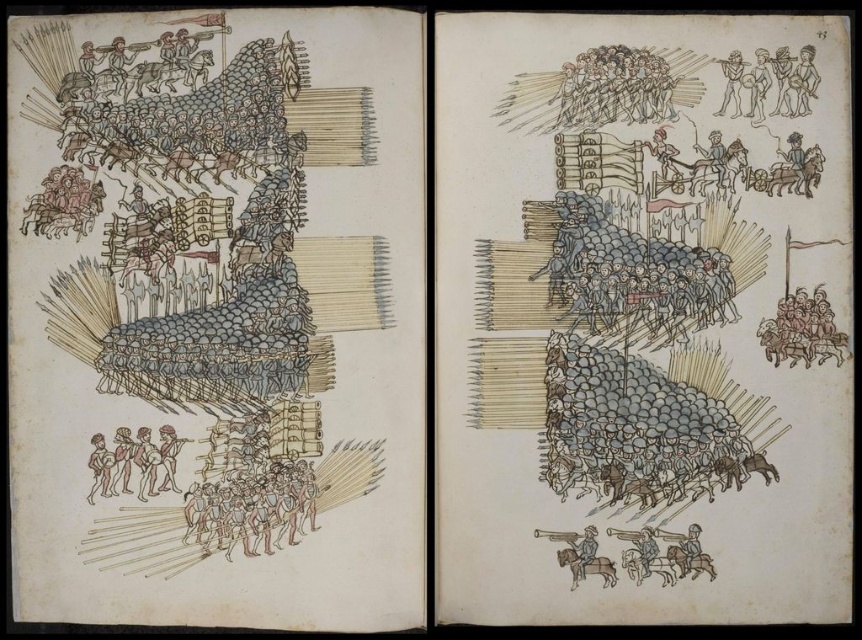
Question: Is blue-gray fabric soldiers at upper center above brown leather boots at lower left?

Choices:
 (A) yes
 (B) no

Answer: (A)

Question: Can you confirm if brown leather armor at lower right is positioned below golden armor at lower right?

Choices:
 (A) yes
 (B) no

Answer: (A)

Question: Which is farther from the blue-gray fabric soldiers at upper center?

Choices:
 (A) brown leather boots at lower left
 (B) brown leather horse at lower right
 (C) brown wood soldiers at upper center
 (D) golden armor at lower right

Answer: (A)

Question: Which point is farther to the camera?

Choices:
 (A) (681, 545)
 (B) (582, 99)

Answer: (B)

Question: Estimate the real-world distances between objects in this image. Which object is closer to the golden armor at lower right?

Choices:
 (A) brown wood soldiers at upper center
 (B) brown leather armor at lower right
 (C) brown leather horse at lower right
 (D) wooden flute at upper right

Answer: (B)

Question: Observing the image, what is the correct spatial positioning of brown wood soldiers at upper center in reference to brown leather armor at lower right?

Choices:
 (A) left
 (B) right

Answer: (A)